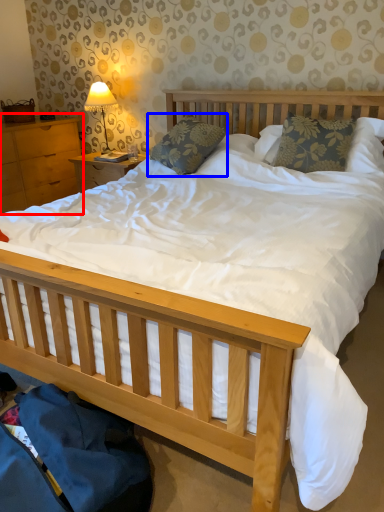
Question: Among these objects, which one is farthest to the camera, nightstand (highlighted by a red box) or pillow (highlighted by a blue box)?

Choices:
 (A) nightstand
 (B) pillow

Answer: (A)